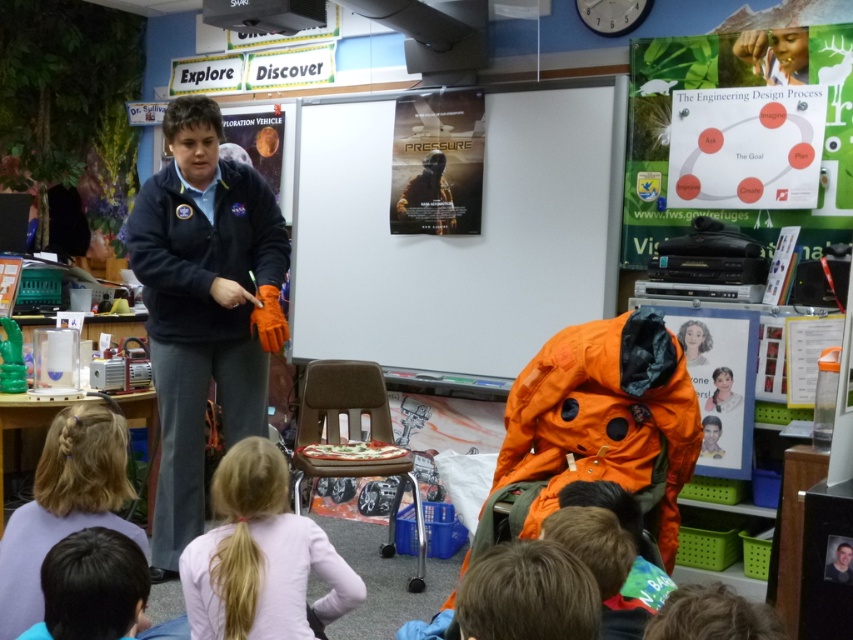
Is matte orange poster at center thinner than pink fabric shirt at lower center?

Incorrect, matte orange poster at center's width is not less than pink fabric shirt at lower center's.

Is matte orange poster at center positioned behind pink fabric shirt at lower center?

Yes, it is behind pink fabric shirt at lower center.

This screenshot has height=640, width=853. In order to click on matte orange poster at center in this screenshot , I will do `click(457, 236)`.

Is matte orange poster at center closer to the viewer compared to navy blue fleece jacket at center?

No, matte orange poster at center is further to the viewer.

Is matte orange poster at center above navy blue fleece jacket at center?

Correct, matte orange poster at center is located above navy blue fleece jacket at center.

Between point (596, 81) and point (242, 221), which one is positioned in front?

Positioned in front is point (242, 221).

Find the location of `matte orange poster at center`. matte orange poster at center is located at coordinates (457, 236).

Can you confirm if navy blue fleece jacket at center is smaller than blonde hair at lower left?

No.

Does navy blue fleece jacket at center appear over blonde hair at lower left?

Yes.

Is point (184, 97) behind point (51, 445)?

That is True.

The height and width of the screenshot is (640, 853). What are the coordinates of `navy blue fleece jacket at center` in the screenshot? It's located at (204, 307).